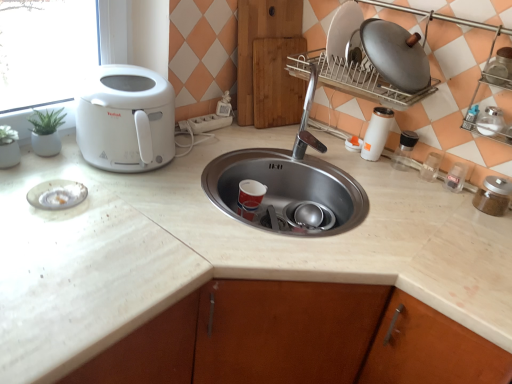
You are a GUI agent. You are given a task and a screenshot of the screen. Output one action in this format:
    pyautogui.click(x=<x>, y=<y>)
    Task: Click on the free space to the left of white plastic soap dispenser at upper right, the 8th appliance viewed from the right
    Image resolution: width=512 pixels, height=384 pixels.
    Given the screenshot: What is the action you would take?
    pyautogui.click(x=314, y=135)